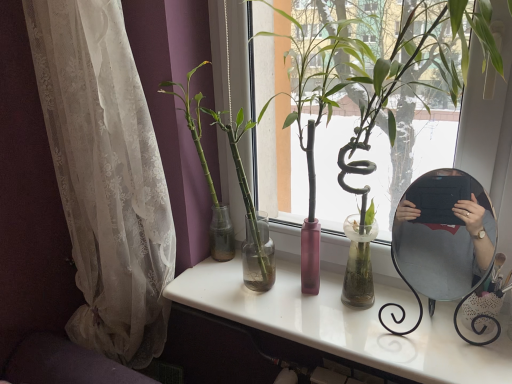
Image resolution: width=512 pixels, height=384 pixels. In order to click on vacant area on top of white glossy desk at center (from a real-world perspective) in this screenshot , I will do `click(332, 302)`.